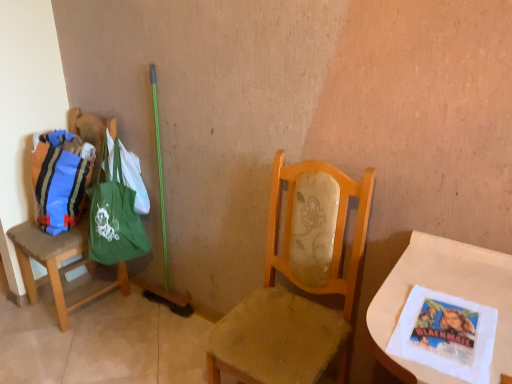
Question: Is green canvas tote at left facing away from white paper napkin at lower right?

Choices:
 (A) yes
 (B) no

Answer: (B)

Question: Does green canvas tote at left appear on the left side of white paper napkin at lower right?

Choices:
 (A) no
 (B) yes

Answer: (B)

Question: From the image's perspective, would you say green canvas tote at left is positioned over white paper napkin at lower right?

Choices:
 (A) no
 (B) yes

Answer: (B)

Question: Is green canvas tote at left outside white paper napkin at lower right?

Choices:
 (A) no
 (B) yes

Answer: (B)

Question: Is green canvas tote at left far from white paper napkin at lower right?

Choices:
 (A) no
 (B) yes

Answer: (B)

Question: Is green canvas tote at left at the right side of white paper napkin at lower right?

Choices:
 (A) yes
 (B) no

Answer: (B)

Question: Is white paper napkin at lower right taller than green fabric bag at left, the second chair when ordered from right to left?

Choices:
 (A) yes
 (B) no

Answer: (B)

Question: Does white paper napkin at lower right come in front of green fabric bag at left, marked as the 1th chair in a back-to-front arrangement?

Choices:
 (A) yes
 (B) no

Answer: (A)

Question: From the image's perspective, does white paper napkin at lower right appear higher than green fabric bag at left, which is the 1th chair in left-to-right order?

Choices:
 (A) yes
 (B) no

Answer: (B)

Question: From a real-world perspective, is white paper napkin at lower right on green fabric bag at left, marked as the 1th chair in a back-to-front arrangement?

Choices:
 (A) no
 (B) yes

Answer: (B)

Question: From a real-world perspective, does white paper napkin at lower right sit lower than green fabric bag at left, the 2th chair when ordered from front to back?

Choices:
 (A) yes
 (B) no

Answer: (B)

Question: Is white paper napkin at lower right further to the viewer compared to green fabric bag at left, marked as the 1th chair in a back-to-front arrangement?

Choices:
 (A) yes
 (B) no

Answer: (B)

Question: Considering the relative positions of green canvas tote at left and green fabric bag at left, the second chair when ordered from right to left, in the image provided, is green canvas tote at left to the left of green fabric bag at left, the second chair when ordered from right to left, from the viewer's perspective?

Choices:
 (A) no
 (B) yes

Answer: (A)